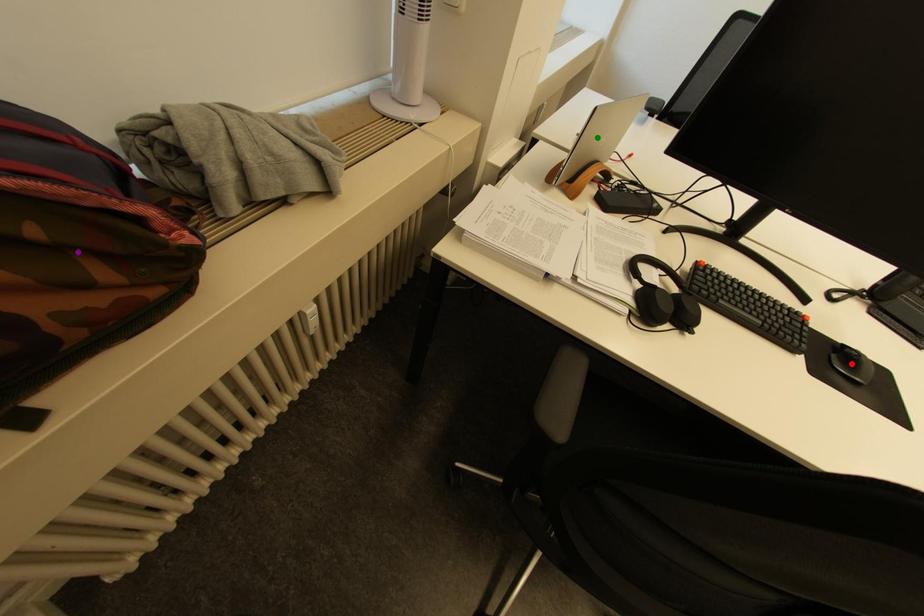
Order these from nearest to farthest:
green point | red point | purple point

purple point, red point, green point